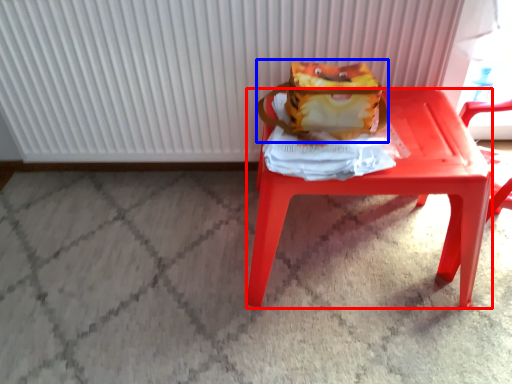
Question: Which object appears farthest to the camera in this image, stool (highlighted by a red box) or shoulder bag (highlighted by a blue box)?

Choices:
 (A) stool
 (B) shoulder bag

Answer: (B)